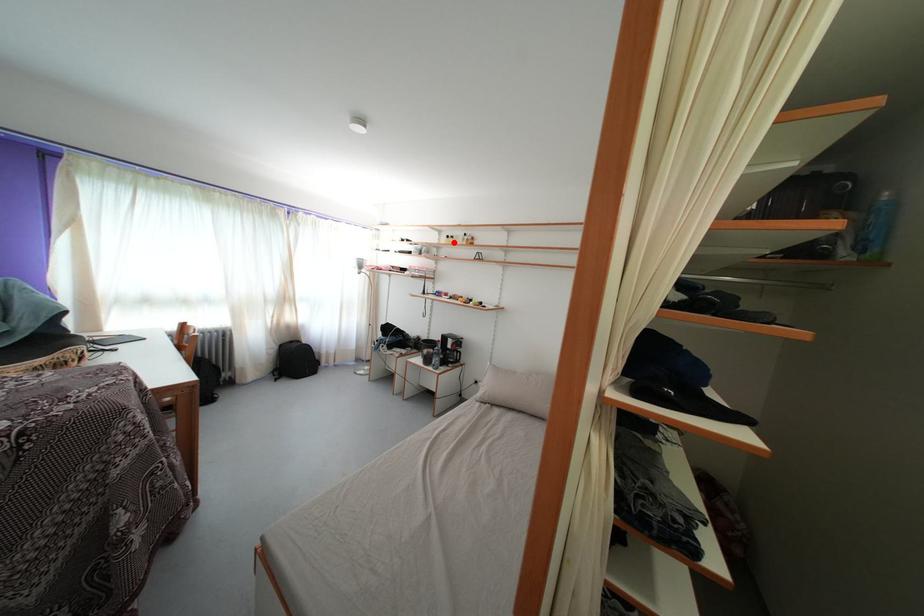
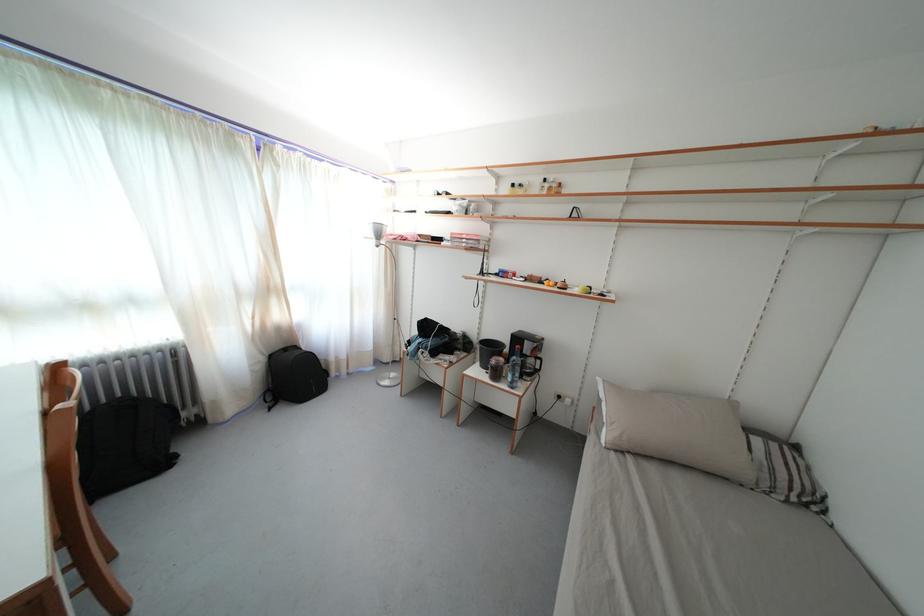
The point at the highlighted location is marked in the first image. Where is the corresponding point in the second image?

(518, 191)